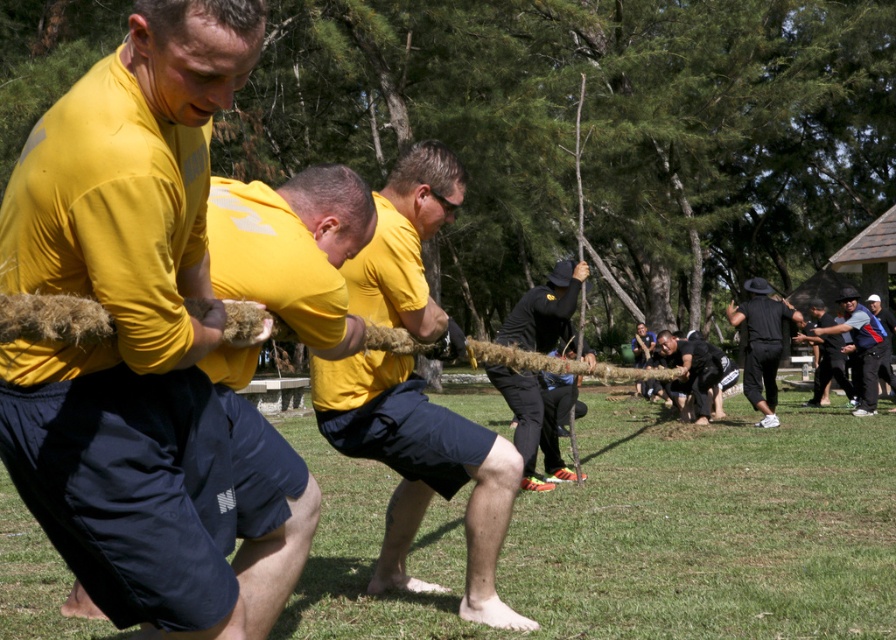
Question: Can you confirm if matte yellow shirt at center is thinner than black leather jacket at center?

Choices:
 (A) yes
 (B) no

Answer: (A)

Question: Is black matte hat at upper right to the right of black leather jacket at center from the viewer's perspective?

Choices:
 (A) yes
 (B) no

Answer: (A)

Question: Does black matte baseball cap at center come in front of black leather jacket at center?

Choices:
 (A) no
 (B) yes

Answer: (B)

Question: Among these objects, which one is nearest to the camera?

Choices:
 (A) black matte hat at upper right
 (B) yellow matte shirt at center

Answer: (B)

Question: Which of the following is the farthest from the observer?

Choices:
 (A) (112, 563)
 (B) (867, 404)
 (C) (751, 280)

Answer: (C)

Question: Which object is closer to the camera taking this photo?

Choices:
 (A) yellow matte shirt at center
 (B) black matte hat at upper right
 (C) matte yellow shirt at center
 (D) black leather jacket at center

Answer: (C)